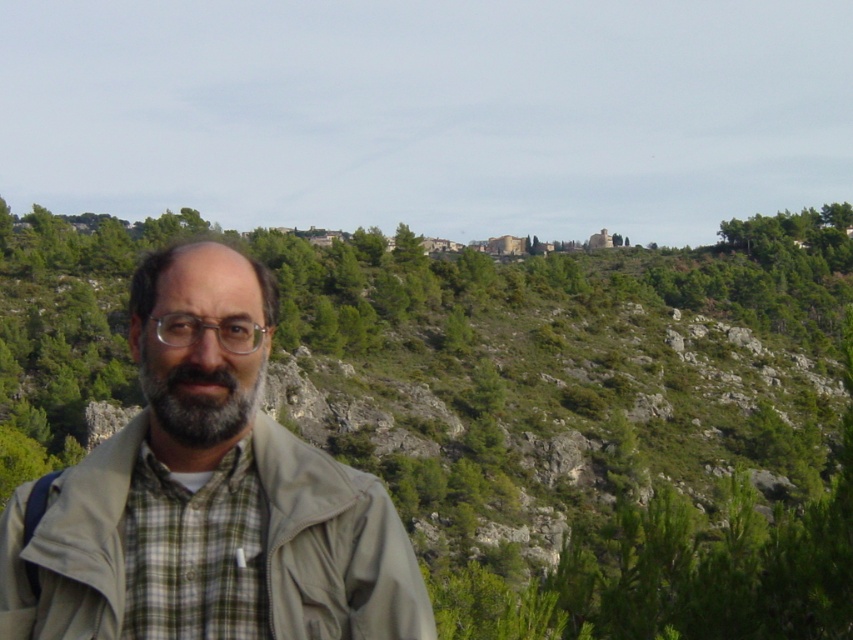
Does green leafy tree at center have a greater width compared to gray matte beard at center?

Indeed, green leafy tree at center has a greater width compared to gray matte beard at center.

Who is more distant from viewer, (296, 275) or (142, 358)?

The point (296, 275) is more distant.

What are the coordinates of `green leafy tree at center` in the screenshot? It's located at (590, 422).

Where is `green leafy tree at center`? The height and width of the screenshot is (640, 853). green leafy tree at center is located at coordinates (590, 422).

Which is above, green leafy tree at center or green plaid shirt at center?

green leafy tree at center

Measure the distance between green leafy tree at center and camera.

green leafy tree at center is 76.77 feet from camera.

Find the location of a particular element. This screenshot has height=640, width=853. green leafy tree at center is located at coordinates (590, 422).

Is point (7, 604) less distant than point (213, 564)?

Yes, it is in front of point (213, 564).

From the picture: Which of these two, beige fabric jacket at center or green plaid shirt at center, stands taller?

beige fabric jacket at center is taller.

Which is behind, point (250, 289) or point (131, 609)?

The point (250, 289) is behind.

Find the location of `beige fabric jacket at center`. beige fabric jacket at center is located at coordinates (207, 496).